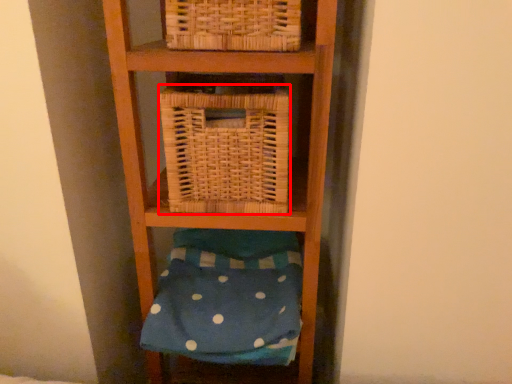
Question: In this image, where is basket (annotated by the red box) located relative to pillow?

Choices:
 (A) left
 (B) right

Answer: (B)